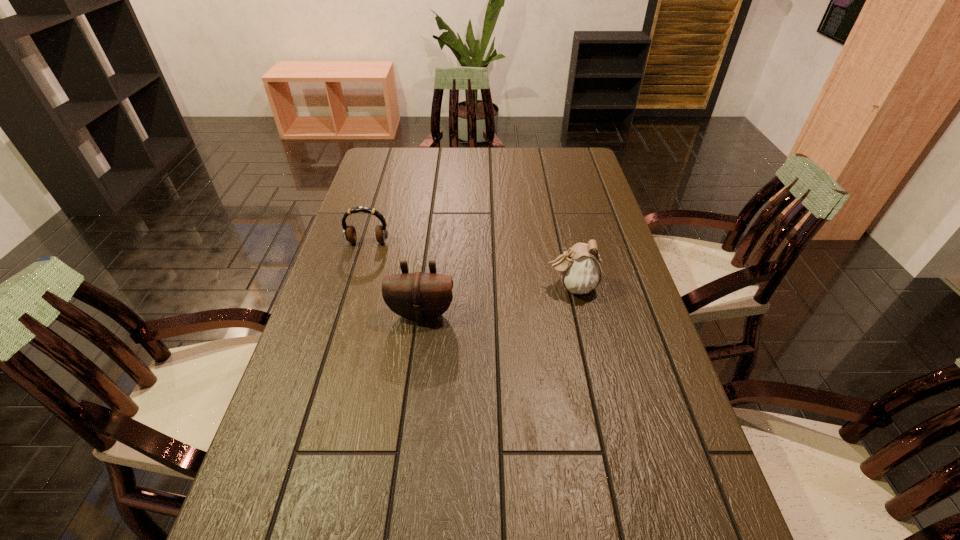
Locate an element on the screen. empty location between the right pouch and the second object from left to right is located at coordinates (496, 300).

Where is `vacant region between the second object from right to left and the rightmost object`? vacant region between the second object from right to left and the rightmost object is located at coordinates (496, 300).

Image resolution: width=960 pixels, height=540 pixels. I want to click on object that is the closest one to the left pouch, so [x=349, y=233].

Locate an element on the screen. Image resolution: width=960 pixels, height=540 pixels. object that is the nearest to the rightmost object is located at coordinates (418, 296).

What are the coordinates of `vacant area in the image that satisfies the following two spatial constraints: 1. on the front-facing side of the rightmost object; 2. with the flap open on the left pouch` in the screenshot? It's located at (577, 314).

Where is `free space that satisfies the following two spatial constraints: 1. on the front-facing side of the rightmost object; 2. with the flap open on the second object from left to right`? free space that satisfies the following two spatial constraints: 1. on the front-facing side of the rightmost object; 2. with the flap open on the second object from left to right is located at coordinates (577, 314).

Locate an element on the screen. vacant space that satisfies the following two spatial constraints: 1. on the front-facing side of the rightmost object; 2. with the flap open on the second object from right to left is located at coordinates (577, 314).